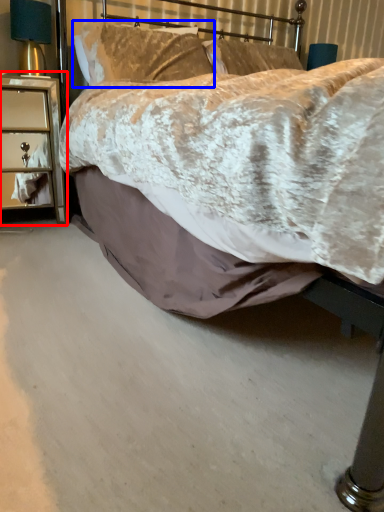
Question: Which object appears farthest to the camera in this image, nightstand (highlighted by a red box) or pillow (highlighted by a blue box)?

Choices:
 (A) nightstand
 (B) pillow

Answer: (B)